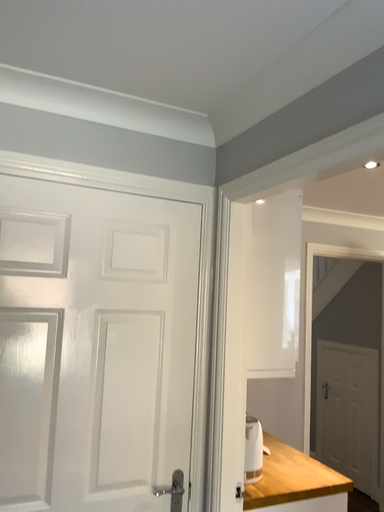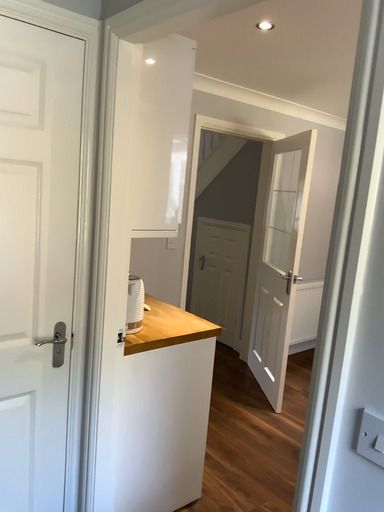
Question: Which way did the camera rotate in the video?

Choices:
 (A) rotated left
 (B) rotated right

Answer: (B)